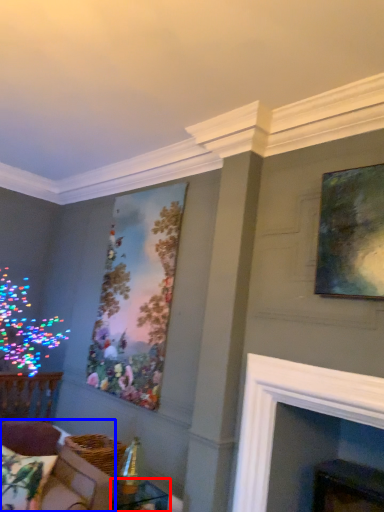
Question: Which of the following is the closest to the observer, table (highlighted by a red box) or couch (highlighted by a blue box)?

Choices:
 (A) table
 (B) couch

Answer: (B)